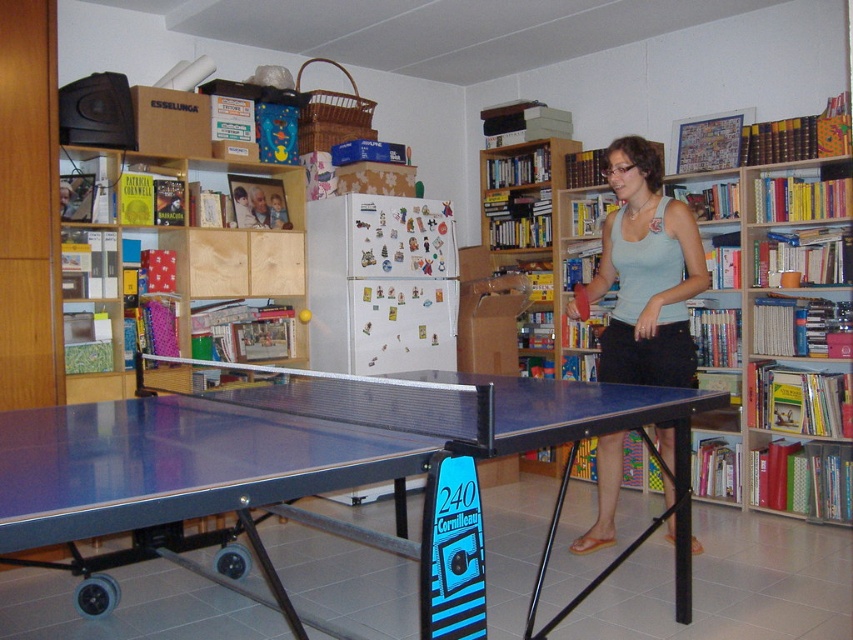
Question: Which object is positioned farthest from the blue plastic table tennis table at center?

Choices:
 (A) wooden bookshelf at upper center
 (B) wooden bookshelf at upper left
 (C) light blue tank top at center
 (D) blue glossy ping pong table at center

Answer: (B)

Question: Which of these objects is positioned farthest from the wooden bookshelf at upper left?

Choices:
 (A) wooden bookshelf at upper center
 (B) light blue tank top at center

Answer: (A)

Question: Which of the following is the closest to the observer?

Choices:
 (A) (117, 250)
 (B) (573, 305)

Answer: (B)

Question: Is wooden bookshelf at upper left smaller than blue plastic table tennis table at center?

Choices:
 (A) no
 (B) yes

Answer: (A)

Question: Where is wooden bookshelf at upper center located in relation to blue plastic table tennis table at center in the image?

Choices:
 (A) right
 (B) left

Answer: (A)

Question: Can you confirm if blue glossy ping pong table at center is thinner than light blue tank top at center?

Choices:
 (A) no
 (B) yes

Answer: (A)